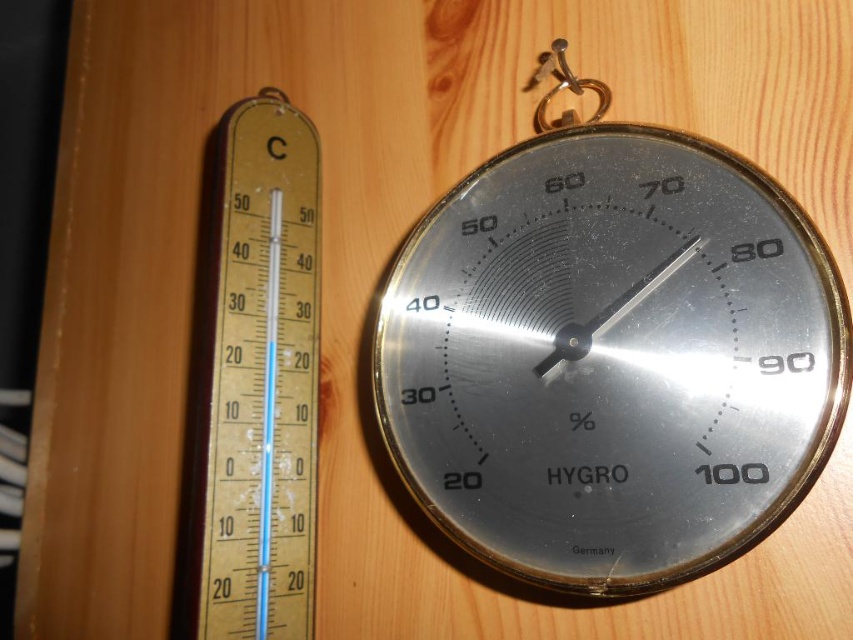
You are a scientist setting up equipment for an experiment. You need to place a third instrument between the metallic silver hygrometer at center and the gold textured thermometer at left. Based on their positions, where should you place the new instrument?

The metallic silver hygrometer at center is above the gold textured thermometer at left, so you should place the new instrument in between them vertically, below the hygrometer and above the thermometer.

You are setting up a science experiment and need to place both the gold textured thermometer at left and the gold metallic hook at upper center on a shelf. The shelf has limited space. Based on their positions in the image, which object is closer to the edge of the shelf?

The gold textured thermometer at left is located below the gold metallic hook at upper center, meaning it is positioned lower on the shelf. Therefore, the gold metallic hook at upper center is closer to the edge of the shelf.

You are a scientist who needs to place a 10 inch ruler between the metallic silver hygrometer at center and the gold metallic hook at upper center. Can you fit the ruler between them without bending it?

The metallic silver hygrometer at center is 9.99 inches from the gold metallic hook at upper center. Since the ruler is exactly 10 inches long, it would not fit between them without bending because the distance is slightly less than the ruler length.